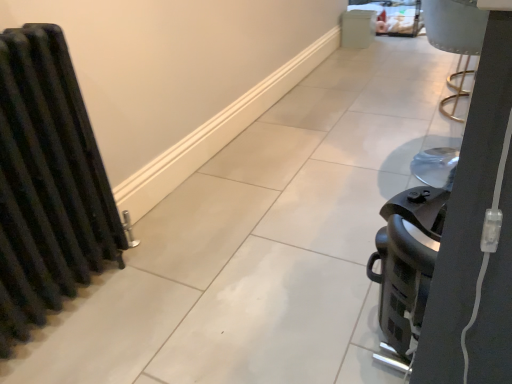
Question: Is black matte radiator at left shorter than black plastic coffee maker at right, positioned as the 1th appliance in bottom-to-top order?

Choices:
 (A) no
 (B) yes

Answer: (A)

Question: Considering the relative positions of black matte radiator at left and black plastic coffee maker at right, the second appliance positioned from the top, in the image provided, is black matte radiator at left to the left of black plastic coffee maker at right, the second appliance positioned from the top, from the viewer's perspective?

Choices:
 (A) no
 (B) yes

Answer: (B)

Question: From the image's perspective, is black matte radiator at left over black plastic coffee maker at right, the second appliance positioned from the top?

Choices:
 (A) no
 (B) yes

Answer: (B)

Question: From the image's perspective, is black matte radiator at left under black plastic coffee maker at right, the second appliance positioned from the top?

Choices:
 (A) yes
 (B) no

Answer: (B)

Question: Is black matte radiator at left wider than black plastic coffee maker at right, which is the 2th appliance in right-to-left order?

Choices:
 (A) no
 (B) yes

Answer: (A)

Question: Based on their sizes in the image, would you say black matte radiator at left is bigger or smaller than white matte cabinet at upper center, the 2th appliance in the front-to-back sequence?

Choices:
 (A) small
 (B) big

Answer: (B)

Question: From the image's perspective, relative to white matte cabinet at upper center, arranged as the first appliance when viewed from the back, is black matte radiator at left above or below?

Choices:
 (A) above
 (B) below

Answer: (B)

Question: Is point (32, 112) closer or farther from the camera than point (371, 9)?

Choices:
 (A) farther
 (B) closer

Answer: (B)

Question: Is black matte radiator at left to the left or to the right of white matte cabinet at upper center, arranged as the first appliance when viewed from the back, in the image?

Choices:
 (A) left
 (B) right

Answer: (A)

Question: Is black plastic coffee maker at right, which is the 2th appliance in right-to-left order, to the left or to the right of white matte cabinet at upper center, which ranks as the first appliance in top-to-bottom order, in the image?

Choices:
 (A) left
 (B) right

Answer: (A)

Question: From the image's perspective, relative to white matte cabinet at upper center, which ranks as the first appliance in top-to-bottom order, is black plastic coffee maker at right, the second appliance positioned from the top, above or below?

Choices:
 (A) below
 (B) above

Answer: (A)

Question: From a real-world perspective, is black plastic coffee maker at right, marked as the 2th appliance in a back-to-front arrangement, positioned above or below white matte cabinet at upper center, the second appliance from the bottom?

Choices:
 (A) below
 (B) above

Answer: (B)

Question: Considering the positions of black plastic coffee maker at right, which is the 2th appliance in right-to-left order, and white matte cabinet at upper center, which ranks as the 2th appliance in left-to-right order, in the image, is black plastic coffee maker at right, which is the 2th appliance in right-to-left order, taller or shorter than white matte cabinet at upper center, which ranks as the 2th appliance in left-to-right order,?

Choices:
 (A) tall
 (B) short

Answer: (A)

Question: From the image's perspective, is white matte cabinet at upper center, arranged as the first appliance when viewed from the back, located above or below black plastic coffee maker at right, positioned as the 1th appliance in bottom-to-top order?

Choices:
 (A) below
 (B) above

Answer: (B)

Question: Considering the relative positions of white matte cabinet at upper center, which ranks as the first appliance in top-to-bottom order, and black plastic coffee maker at right, the first appliance positioned from the left, in the image provided, is white matte cabinet at upper center, which ranks as the first appliance in top-to-bottom order, to the left or to the right of black plastic coffee maker at right, the first appliance positioned from the left,?

Choices:
 (A) left
 (B) right

Answer: (B)